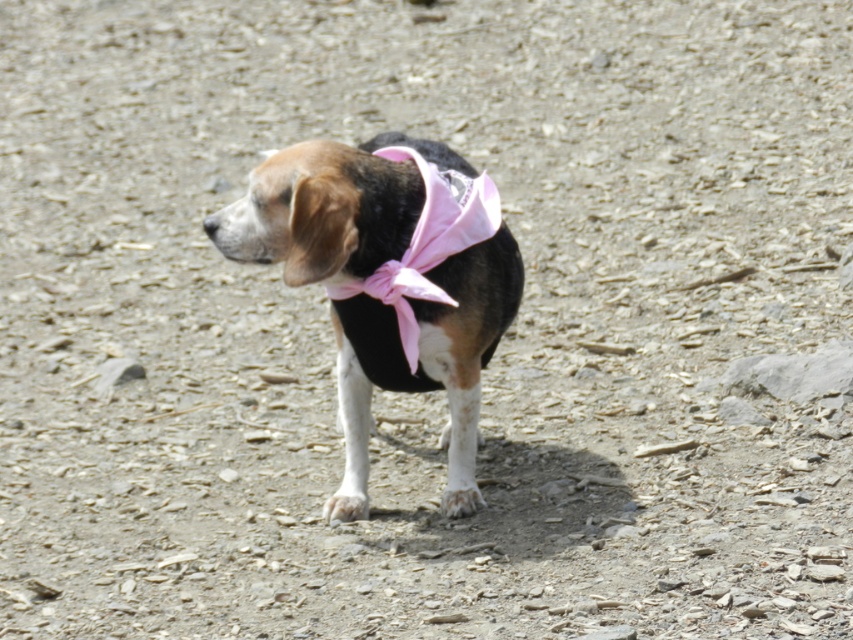
Question: Observing the image, what is the correct spatial positioning of black and white fur dog at center in reference to pink satin bow tie at center?

Choices:
 (A) left
 (B) right

Answer: (A)

Question: Can you confirm if black and white fur dog at center is positioned above pink satin bow tie at center?

Choices:
 (A) no
 (B) yes

Answer: (A)

Question: Can you confirm if black and white fur dog at center is thinner than pink satin bow tie at center?

Choices:
 (A) no
 (B) yes

Answer: (A)

Question: Which of the following is the farthest from the observer?

Choices:
 (A) black and white fur dog at center
 (B) pink satin bow tie at center

Answer: (B)